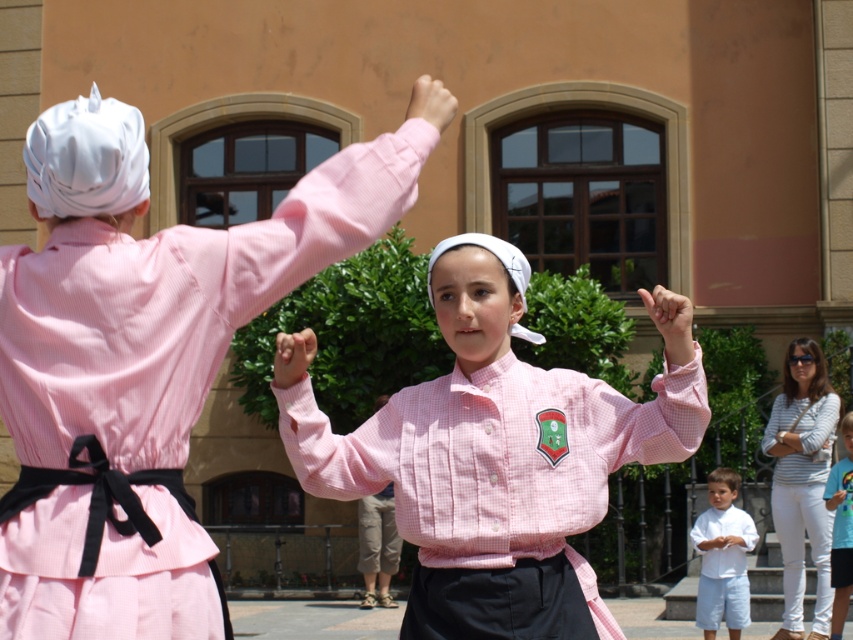
Question: Can you confirm if white striped shirt at upper right is bigger than pink corduroy shirt at center?

Choices:
 (A) yes
 (B) no

Answer: (A)

Question: Where is white striped shirt at upper right located in relation to white cotton shirt at lower right in the image?

Choices:
 (A) below
 (B) above

Answer: (B)

Question: Does white striped shirt at upper right lie in front of pink corduroy shirt at center?

Choices:
 (A) yes
 (B) no

Answer: (B)

Question: Which point is closer to the camera?

Choices:
 (A) pink checkered shirt at center
 (B) white cotton shirt at lower right
 (C) pink corduroy shirt at center
 (D) matte pink dress at back

Answer: (D)

Question: Considering the real-world distances, which object is closest to the matte pink dress at back?

Choices:
 (A) pink checkered shirt at center
 (B) white striped shirt at upper right
 (C) white cotton shirt at lower right
 (D) pink corduroy shirt at center

Answer: (A)

Question: Which point is closer to the camera taking this photo?

Choices:
 (A) (846, 568)
 (B) (15, 321)

Answer: (B)